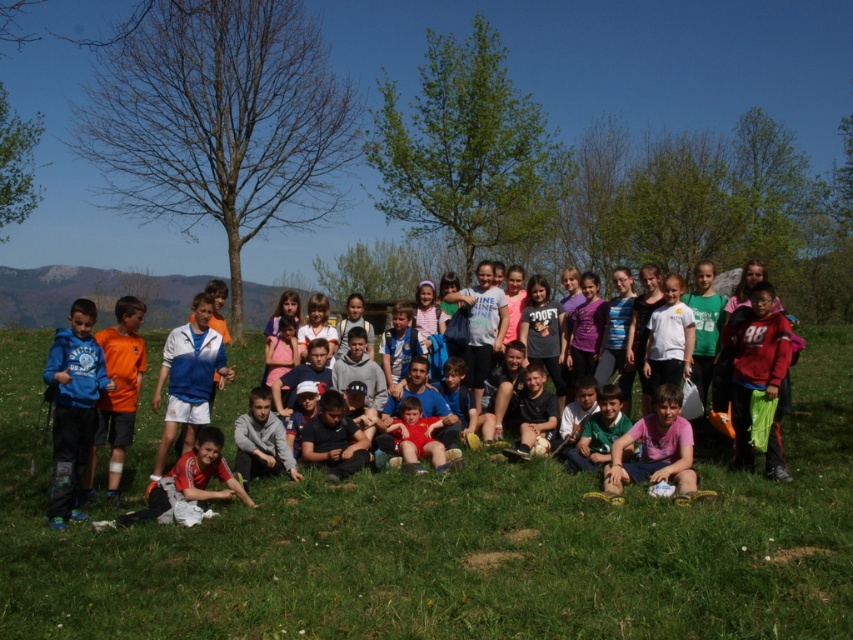
Consider the image. You are a photographer taking a picture of the children on the grassy hillside. You notice two points in the image labeled as point 1 at coordinates [61,436] and point 2 at coordinates [202,317]. Which point is closer to your camera lens?

Point 1 at coordinates [61,436] is closer to the camera lens than point 2 at coordinates [202,317].

Looking at the children on the grassy hillside, where is the matte blue hoodie at center in relation to the blue fleece jacket at lower left?

The matte blue hoodie at center is to the right of the blue fleece jacket at lower left.